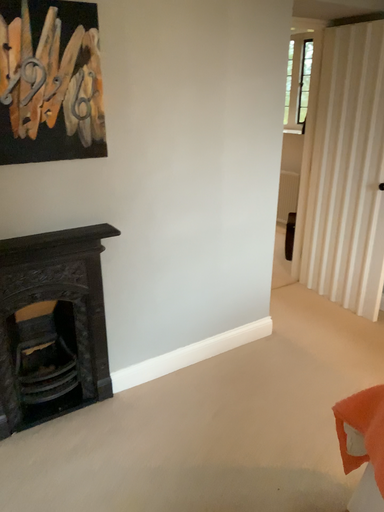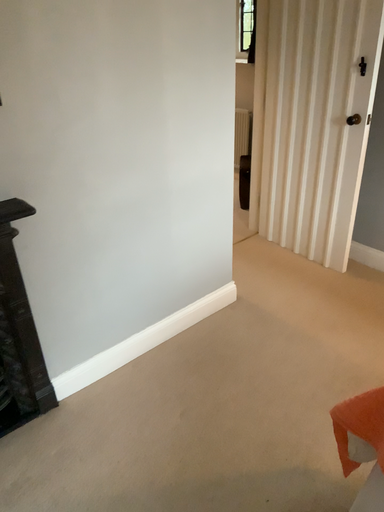
Question: Which way did the camera rotate in the video?

Choices:
 (A) rotated downward
 (B) rotated upward

Answer: (A)